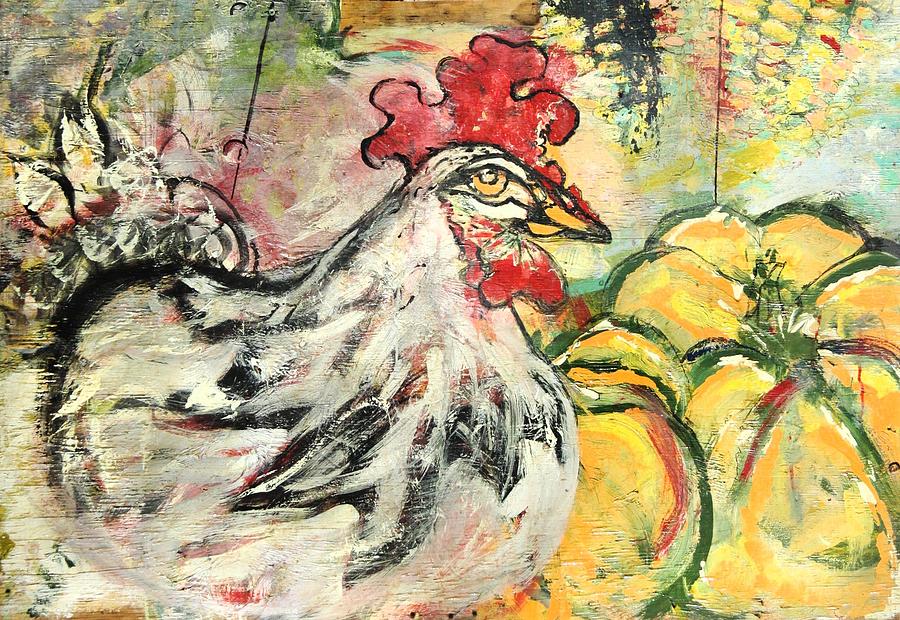
Where is `painting`? The height and width of the screenshot is (620, 900). painting is located at coordinates (613, 198).